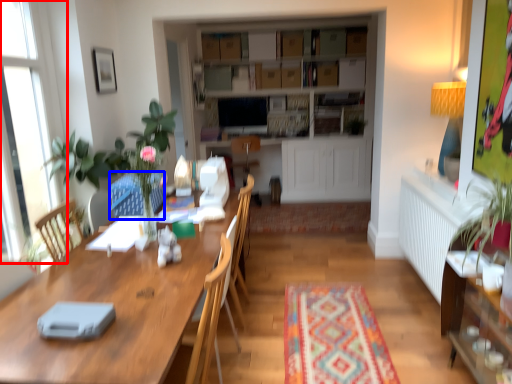
Question: Which point is closer to the camera, window (highlighted by a red box) or swivel chair (highlighted by a blue box)?

Choices:
 (A) window
 (B) swivel chair

Answer: (A)